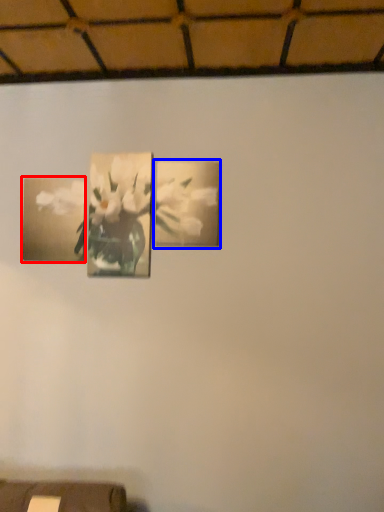
Question: Which object is closer to the camera taking this photo, picture frame (highlighted by a red box) or picture frame (highlighted by a blue box)?

Choices:
 (A) picture frame
 (B) picture frame

Answer: (B)